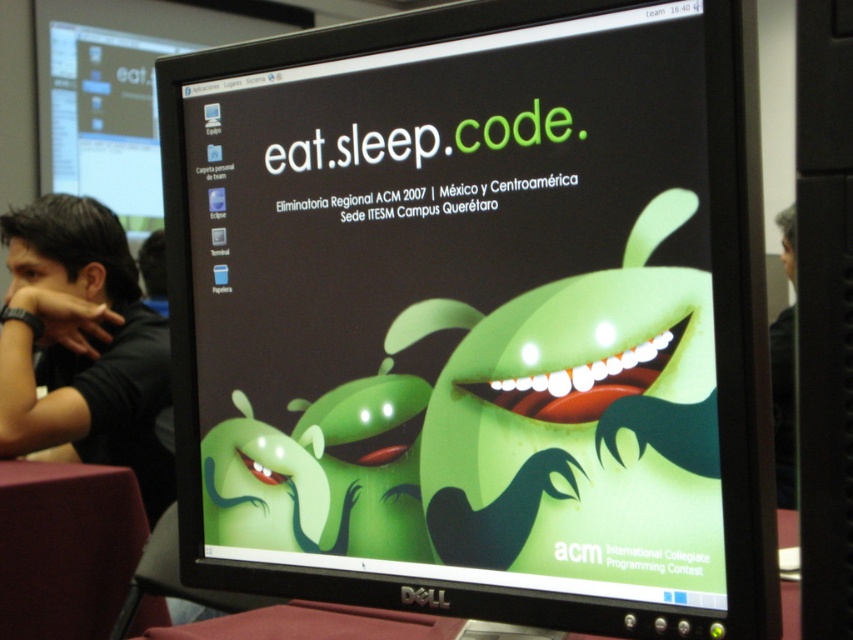
You are sitting at a desk and looking at the Dell computer monitor. You notice the black shirt at left and the maroon fabric table at lower left. Which object is closer to you?

The black shirt at left is closer to you because the maroon fabric table at lower left is behind it.

You are looking at the Dell computer monitor and want to locate the point at coordinates point (477,316). Where exactly on the Dell computer monitor would you find this point?

The point (477,316) corresponds to the green matte screen at center, so you can find it at the center of the Dell computer monitor.